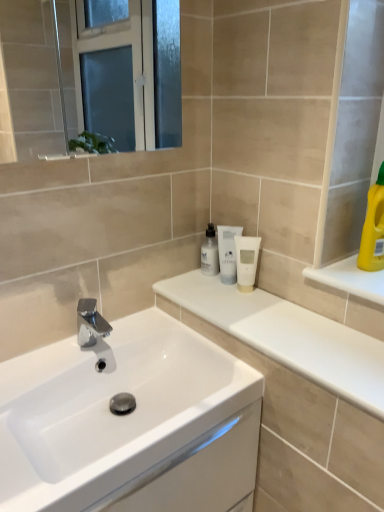
Find the location of a particular element. free space in front of white glossy bottle at center, the 3th mouthwash positioned from the right is located at coordinates (219, 300).